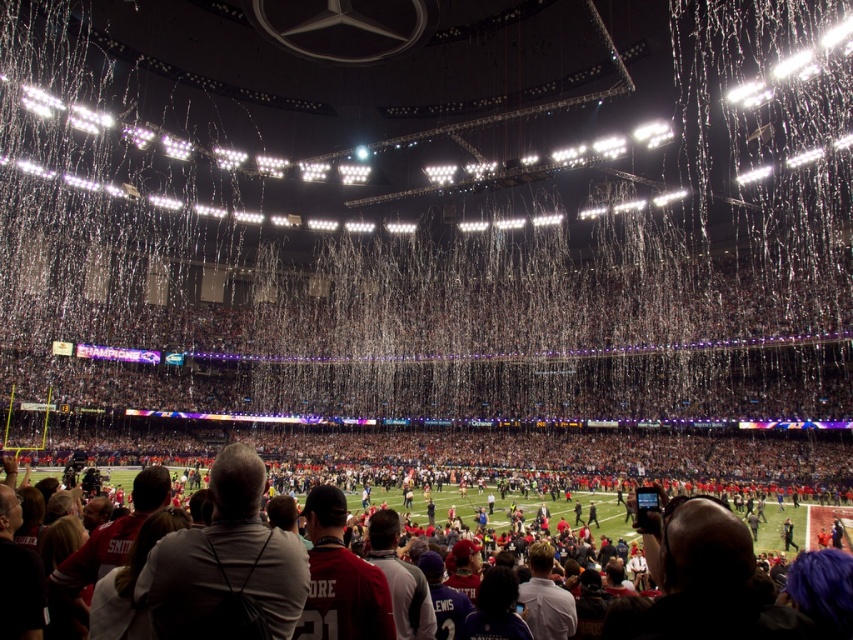
Question: Which of the following is the farthest from the observer?

Choices:
 (A) white paper confetti at center
 (B) red jersey football team at lower center

Answer: (A)

Question: Is white paper confetti at center positioned before red jersey football team at lower center?

Choices:
 (A) no
 (B) yes

Answer: (A)

Question: Is white paper confetti at center below red jersey football team at lower center?

Choices:
 (A) yes
 (B) no

Answer: (B)

Question: Among these objects, which one is nearest to the camera?

Choices:
 (A) white paper confetti at center
 (B) red jersey football team at lower center

Answer: (B)

Question: Which point is farther from the camera taking this photo?

Choices:
 (A) click(421, 404)
 (B) click(540, 492)

Answer: (A)

Question: In this image, where is white paper confetti at center located relative to red jersey football team at lower center?

Choices:
 (A) right
 (B) left

Answer: (B)